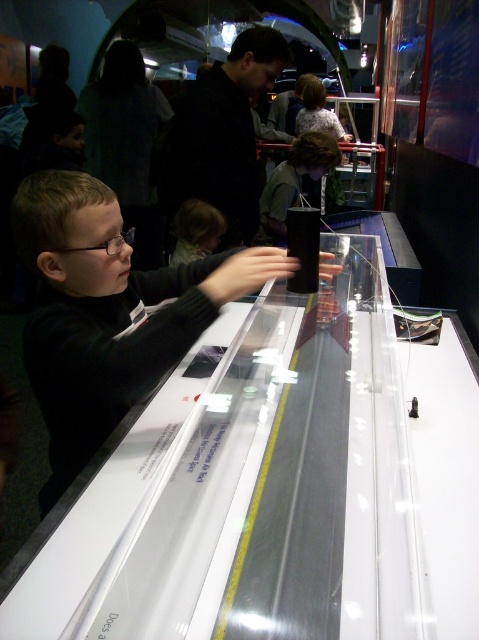
Question: Among these points, which one is farthest from the camera?

Choices:
 (A) (183, 234)
 (B) (123, 376)

Answer: (A)

Question: Which of the following is the farthest from the observer?

Choices:
 (A) (68, 202)
 (B) (214, 232)

Answer: (B)

Question: Does matte black shirt at center have a smaller size compared to smooth brown hair at center?

Choices:
 (A) no
 (B) yes

Answer: (A)

Question: Can you confirm if matte black shirt at center is positioned to the right of smooth brown hair at center?

Choices:
 (A) yes
 (B) no

Answer: (B)

Question: Is matte black shirt at center closer to camera compared to smooth brown hair at center?

Choices:
 (A) yes
 (B) no

Answer: (A)